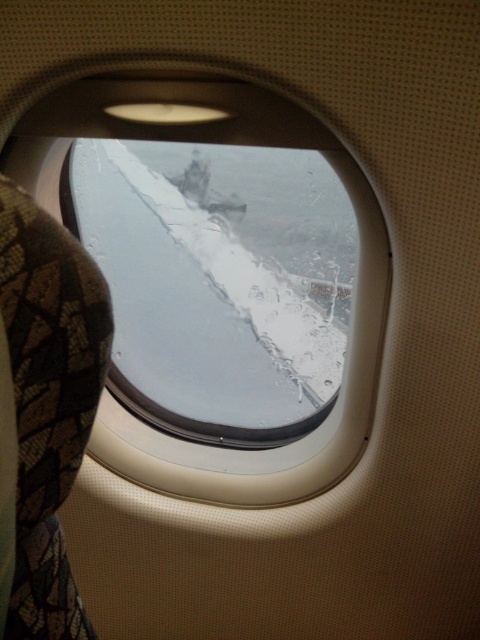
You are a passenger on an airplane and want to look outside through the window. You notice two layers of glass in front of you. The first layer is the white frosted glass at center, and the second layer is the transparent glass airplane window at center. Can you determine which layer is closer to you?

The white frosted glass at center is closer to you because it is the first layer you see when looking through the window, and the distance between them is 10.60 inches.